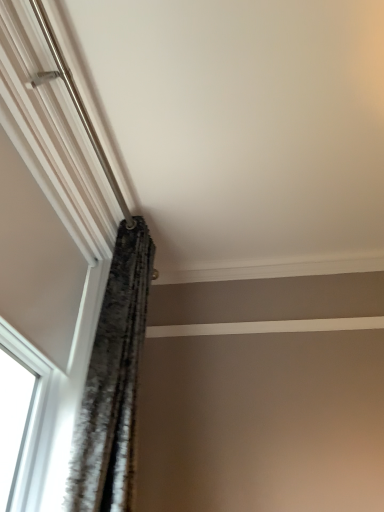
What do you see at coordinates (64, 290) in the screenshot? The width and height of the screenshot is (384, 512). I see `white textured window at upper left` at bounding box center [64, 290].

Find the location of `white textured window at upper left`. white textured window at upper left is located at coordinates (64, 290).

You are a GUI agent. You are given a task and a screenshot of the screen. Output one action in this format:
    pyautogui.click(x=<x>, y=<y>)
    Task: Click on the velvet-like gray curtain at upper left
    
    Given the screenshot: What is the action you would take?
    pyautogui.click(x=113, y=382)

What do you see at coordinates (113, 382) in the screenshot? I see `velvet-like gray curtain at upper left` at bounding box center [113, 382].

Where is `white textured window at upper left`? This screenshot has height=512, width=384. white textured window at upper left is located at coordinates (64, 290).

In the scene shown: Considering the relative positions of velvet-like gray curtain at upper left and white textured window at upper left in the image provided, is velvet-like gray curtain at upper left to the left of white textured window at upper left from the viewer's perspective?

Incorrect, velvet-like gray curtain at upper left is not on the left side of white textured window at upper left.

Considering the positions of objects velvet-like gray curtain at upper left and white textured window at upper left in the image provided, who is behind, velvet-like gray curtain at upper left or white textured window at upper left?

velvet-like gray curtain at upper left.

Is point (132, 447) farther from viewer compared to point (20, 480)?

Yes, it is.

From the image's perspective, is velvet-like gray curtain at upper left below white textured window at upper left?

Yes, from the image's perspective, velvet-like gray curtain at upper left is beneath white textured window at upper left.

From a real-world perspective, is velvet-like gray curtain at upper left physically above white textured window at upper left?

Yes.

Which of these two, velvet-like gray curtain at upper left or white textured window at upper left, is thinner?

white textured window at upper left is thinner.

In the scene shown: Who is taller, velvet-like gray curtain at upper left or white textured window at upper left?

With more height is velvet-like gray curtain at upper left.

Considering the relative sizes of velvet-like gray curtain at upper left and white textured window at upper left in the image provided, is velvet-like gray curtain at upper left smaller than white textured window at upper left?

Yes.

Is white textured window at upper left inside velvet-like gray curtain at upper left?

That's incorrect, white textured window at upper left is not inside velvet-like gray curtain at upper left.

Is velvet-like gray curtain at upper left far from white textured window at upper left?

Actually, velvet-like gray curtain at upper left and white textured window at upper left are a little close together.

Is velvet-like gray curtain at upper left oriented towards white textured window at upper left?

No, velvet-like gray curtain at upper left does not turn towards white textured window at upper left.

What's the angular difference between velvet-like gray curtain at upper left and white textured window at upper left's facing directions?

There is a 0.587-degree angle between the facing directions of velvet-like gray curtain at upper left and white textured window at upper left.

The width and height of the screenshot is (384, 512). There is a white textured window at upper left. What are the coordinates of `curtain above it (from a real-world perspective)` in the screenshot? It's located at (113, 382).

Considering the positions of objects white textured window at upper left and velvet-like gray curtain at upper left in the image provided, who is more to the left, white textured window at upper left or velvet-like gray curtain at upper left?

From the viewer's perspective, white textured window at upper left appears more on the left side.

In the image, is white textured window at upper left positioned in front of or behind velvet-like gray curtain at upper left?

In the image, white textured window at upper left appears in front of velvet-like gray curtain at upper left.

Is point (90, 340) behind point (127, 396)?

Yes, point (90, 340) is farther from viewer.

From the image's perspective, which is below, white textured window at upper left or velvet-like gray curtain at upper left?

From the image's view, velvet-like gray curtain at upper left is below.

From a real-world perspective, between white textured window at upper left and velvet-like gray curtain at upper left, who is vertically lower?

white textured window at upper left is physically lower.

In terms of width, does white textured window at upper left look wider or thinner when compared to velvet-like gray curtain at upper left?

Considering their sizes, white textured window at upper left looks slimmer than velvet-like gray curtain at upper left.

Considering the sizes of white textured window at upper left and velvet-like gray curtain at upper left in the image, is white textured window at upper left taller or shorter than velvet-like gray curtain at upper left?

Clearly, white textured window at upper left is shorter compared to velvet-like gray curtain at upper left.

Considering the relative sizes of white textured window at upper left and velvet-like gray curtain at upper left in the image provided, is white textured window at upper left bigger than velvet-like gray curtain at upper left?

Correct, white textured window at upper left is larger in size than velvet-like gray curtain at upper left.

Would you say velvet-like gray curtain at upper left is part of white textured window at upper left's contents?

That's incorrect, velvet-like gray curtain at upper left is not inside white textured window at upper left.

Are white textured window at upper left and velvet-like gray curtain at upper left beside each other?

No, white textured window at upper left is not beside velvet-like gray curtain at upper left.

Is white textured window at upper left facing away from velvet-like gray curtain at upper left?

No, white textured window at upper left is not facing away from velvet-like gray curtain at upper left.

The image size is (384, 512). Find the location of `curtain above the white textured window at upper left (from a real-world perspective)`. curtain above the white textured window at upper left (from a real-world perspective) is located at coordinates (113, 382).

You are a GUI agent. You are given a task and a screenshot of the screen. Output one action in this format:
    pyautogui.click(x=<x>, y=<y>)
    Task: Click on the window located in front of the velvet-like gray curtain at upper left
    This screenshot has width=384, height=512.
    Given the screenshot: What is the action you would take?
    pyautogui.click(x=64, y=290)

Identify the location of window on the left of velvet-like gray curtain at upper left. (64, 290).